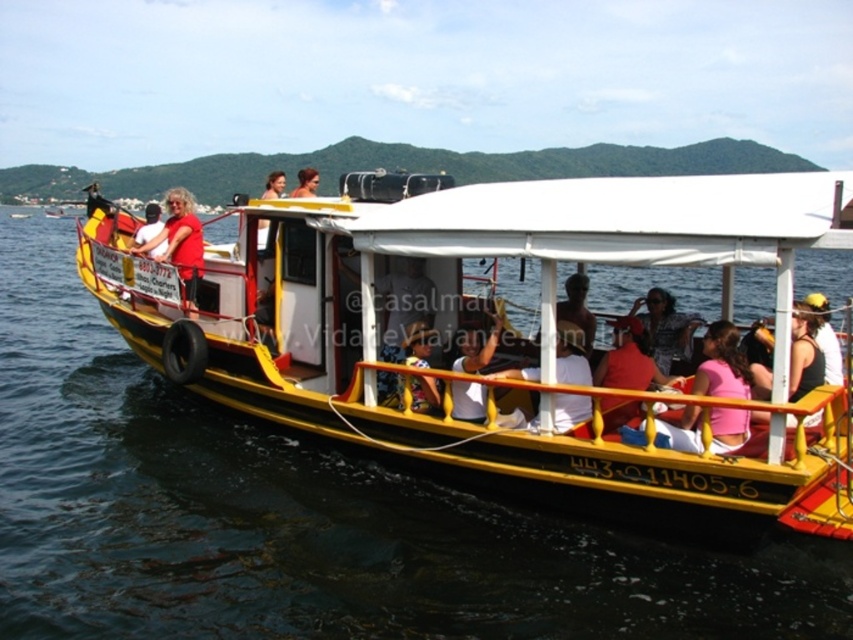
Does yellow matte boat at center appear over matte red shirt at left?

No.

Who is higher up, yellow matte boat at center or matte red shirt at left?

Answer: matte red shirt at left

Identify the location of yellow matte boat at center. This screenshot has width=853, height=640. (474, 314).